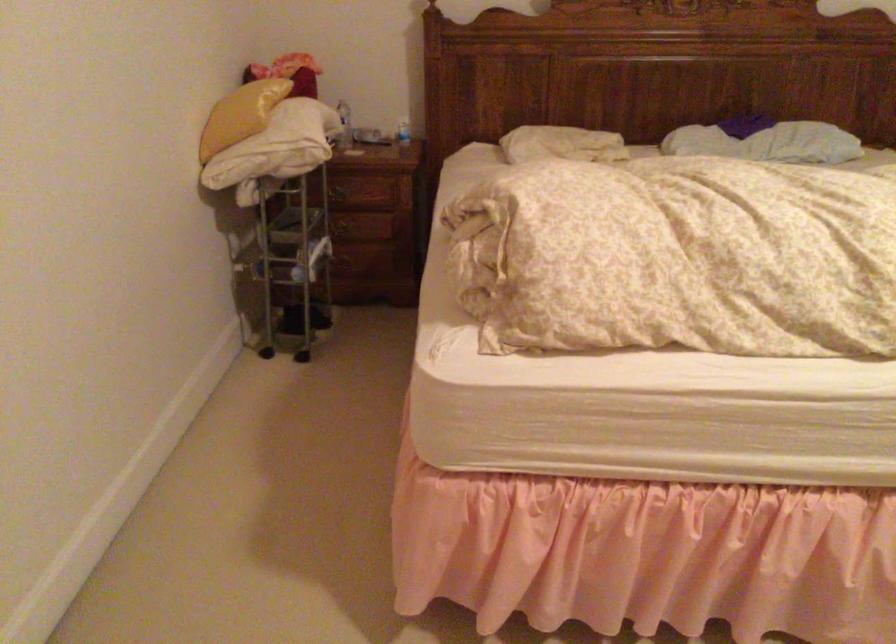
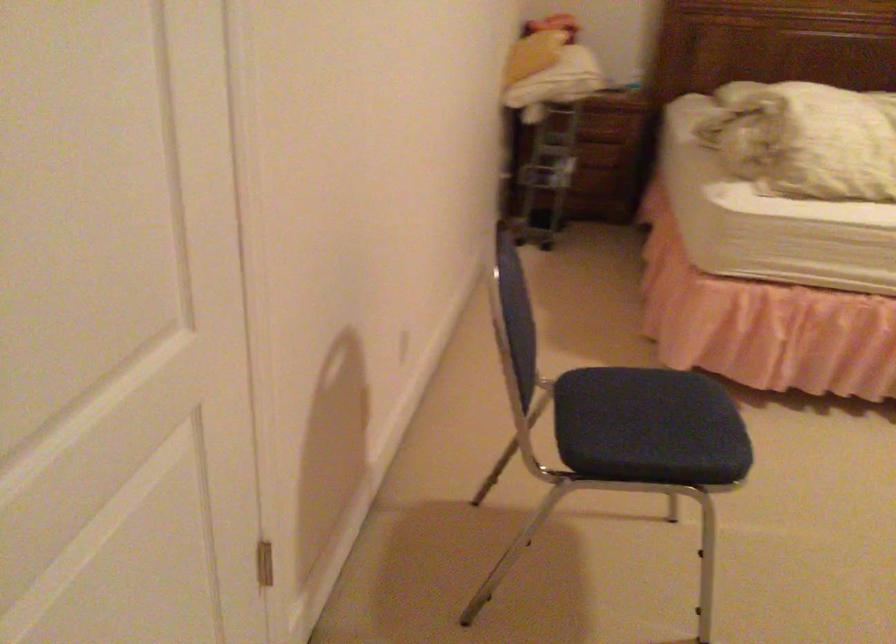
The images are taken continuously from a first-person perspective. In which direction are you moving?

The movement direction of the cameraman is left, backward.